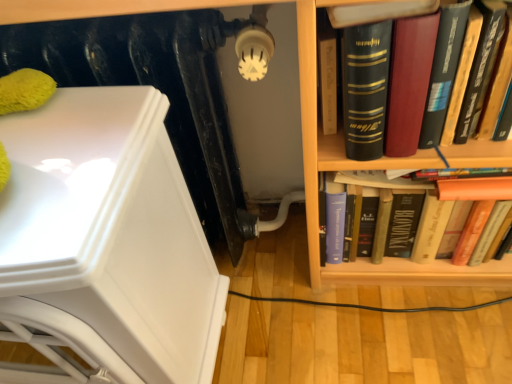
Question: Does point (474, 276) appear closer or farther from the camera than point (441, 145)?

Choices:
 (A) closer
 (B) farther

Answer: (B)

Question: From the image's perspective, is wooden bookshelf at right positioned above or below hardcover book at right?

Choices:
 (A) below
 (B) above

Answer: (A)

Question: Which is nearer to the white glossy armchair at left?

Choices:
 (A) wooden bookshelf at right
 (B) hardcover book at right
 (C) black matte radiator at upper left

Answer: (C)

Question: Which of these objects is positioned closest to the black matte radiator at upper left?

Choices:
 (A) white glossy armchair at left
 (B) wooden bookshelf at right
 (C) hardcover book at right

Answer: (A)